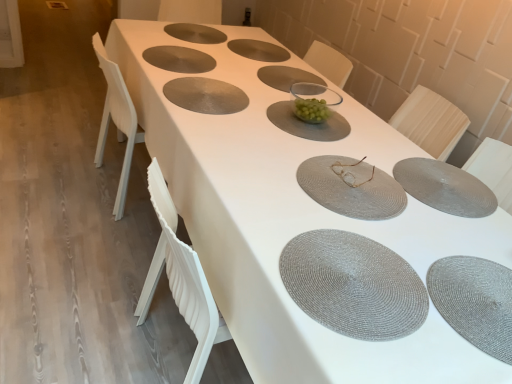
In order to face clear glass bowl at center, arranged as the 6th tableware when ordered from the bottom, should I rotate leftwards or rightwards?

To face it directly, rotate right by 7.644 degrees.

This screenshot has width=512, height=384. Describe the element at coordinates (308, 123) in the screenshot. I see `green glass bowl at center, positioned as the 5th tableware in top-to-bottom order` at that location.

The height and width of the screenshot is (384, 512). Identify the location of matte gray placemat at center, which is counted as the third tableware, starting from the bottom. (351, 187).

I want to click on clear glass bowl at center, which ranks as the 4th tableware in top-to-bottom order, so click(313, 101).

Which is behind, point (199, 90) or point (263, 49)?

Point (263, 49)

Is gray woven placemat at center oriented towards matte gray placemat at upper center, which ranks as the eighth tableware in bottom-to-top order?

No.

How many degrees apart are the facing directions of gray woven placemat at center and matte gray placemat at upper center, which ranks as the eighth tableware in bottom-to-top order?

The facing directions of gray woven placemat at center and matte gray placemat at upper center, which ranks as the eighth tableware in bottom-to-top order, are 178 degrees apart.

Can you confirm if gray woven placemat at center is taller than green glass bowl at center, positioned as the 5th tableware in top-to-bottom order?

Indeed, gray woven placemat at center has a greater height compared to green glass bowl at center, positioned as the 5th tableware in top-to-bottom order.

Is gray woven placemat at center inside the boundaries of green glass bowl at center, arranged as the 5th tableware when ordered from the bottom, or outside?

gray woven placemat at center cannot be found inside green glass bowl at center, arranged as the 5th tableware when ordered from the bottom.

What's the angular difference between gray woven placemat at center and green glass bowl at center, positioned as the 5th tableware in top-to-bottom order,'s facing directions?

The angular difference between gray woven placemat at center and green glass bowl at center, positioned as the 5th tableware in top-to-bottom order, is 3.49 degrees.

Which object is positioned more to the right, gray woven placemat at center or green glass bowl at center, arranged as the 5th tableware when ordered from the bottom?

green glass bowl at center, arranged as the 5th tableware when ordered from the bottom.

Would you say gold metallic glasses at center, the 6th tableware when ordered from top to bottom, is to the left or to the right of gray woven placemat at center, the 2th tableware in the bottom-to-top sequence, in the picture?

gold metallic glasses at center, the 6th tableware when ordered from top to bottom, is positioned on gray woven placemat at center, the 2th tableware in the bottom-to-top sequence,'s left side.

Does gold metallic glasses at center, the 6th tableware when ordered from top to bottom, turn towards gray woven placemat at center, the 2th tableware in the bottom-to-top sequence?

No, gold metallic glasses at center, the 6th tableware when ordered from top to bottom, is not oriented towards gray woven placemat at center, the 2th tableware in the bottom-to-top sequence.

From a real-world perspective, which is physically below, gold metallic glasses at center, which is the fourth tableware from bottom to top, or gray woven placemat at center, the 2th tableware in the bottom-to-top sequence?

gray woven placemat at center, the 2th tableware in the bottom-to-top sequence.

In terms of size, does gold metallic glasses at center, the 6th tableware when ordered from top to bottom, appear bigger or smaller than gray woven placemat at center, the 2th tableware in the bottom-to-top sequence?

Clearly, gold metallic glasses at center, the 6th tableware when ordered from top to bottom, is smaller in size than gray woven placemat at center, the 2th tableware in the bottom-to-top sequence.

Considering their positions, is matte gray placemat at upper center, the second tableware from the top, located in front of or behind gray woven placemat at center, the 2th tableware in the bottom-to-top sequence?

Clearly, matte gray placemat at upper center, the second tableware from the top, is behind gray woven placemat at center, the 2th tableware in the bottom-to-top sequence.

Is there a large distance between matte gray placemat at upper center, the second tableware from the top, and gray woven placemat at center, the 8th tableware positioned from the top?

That's right, there is a large distance between matte gray placemat at upper center, the second tableware from the top, and gray woven placemat at center, the 8th tableware positioned from the top.

From the image's perspective, which tableware is the 6th one above the gray woven placemat at center, the 2th tableware in the bottom-to-top sequence? Please provide its 2D coordinates.

[(258, 50)]

From the image's perspective, is matte gray placemat at upper center, which ranks as the eighth tableware in bottom-to-top order, located above gray woven placemat at center, the 2th tableware in the bottom-to-top sequence?

Indeed, from the image's perspective, matte gray placemat at upper center, which ranks as the eighth tableware in bottom-to-top order, is shown above gray woven placemat at center, the 2th tableware in the bottom-to-top sequence.

Is gray woven placemat at lower right, the 1th tableware from the bottom, wider than green glass bowl at center, positioned as the 5th tableware in top-to-bottom order?

No, gray woven placemat at lower right, the 1th tableware from the bottom, is not wider than green glass bowl at center, positioned as the 5th tableware in top-to-bottom order.

Considering the sizes of objects gray woven placemat at lower right, the 1th tableware from the bottom, and green glass bowl at center, arranged as the 5th tableware when ordered from the bottom, in the image provided, who is taller, gray woven placemat at lower right, the 1th tableware from the bottom, or green glass bowl at center, arranged as the 5th tableware when ordered from the bottom,?

gray woven placemat at lower right, the 1th tableware from the bottom, is taller.

Considering the sizes of objects gray woven placemat at lower right, acting as the 9th tableware starting from the top, and green glass bowl at center, arranged as the 5th tableware when ordered from the bottom, in the image provided, who is smaller, gray woven placemat at lower right, acting as the 9th tableware starting from the top, or green glass bowl at center, arranged as the 5th tableware when ordered from the bottom,?

Smaller between the two is green glass bowl at center, arranged as the 5th tableware when ordered from the bottom.

Between matte gray placemat at upper center, the ninth tableware when ordered from bottom to top, and green glass bowl at center, arranged as the 5th tableware when ordered from the bottom, which one has larger size?

green glass bowl at center, arranged as the 5th tableware when ordered from the bottom, is bigger.

From a real-world perspective, which object rests below the other?

In real-world perspective, matte gray placemat at upper center, the ninth tableware when ordered from bottom to top, is lower.

Is matte gray placemat at upper center, the 1th tableware viewed from the top, taller or shorter than green glass bowl at center, positioned as the 5th tableware in top-to-bottom order?

Clearly, matte gray placemat at upper center, the 1th tableware viewed from the top, is taller compared to green glass bowl at center, positioned as the 5th tableware in top-to-bottom order.

Consider the image. Could green glass bowl at center, arranged as the 5th tableware when ordered from the bottom, be considered to be inside matte gray placemat at upper center, the ninth tableware when ordered from bottom to top?

No, green glass bowl at center, arranged as the 5th tableware when ordered from the bottom, is not a part of matte gray placemat at upper center, the ninth tableware when ordered from bottom to top.

How distant is gray woven placemat at lower right, the 1th tableware from the bottom, from matte gray placemat at upper center, the third tableware from the top?

4.70 feet.

The height and width of the screenshot is (384, 512). I want to click on the 2nd tableware directly above the gray woven placemat at lower right, acting as the 9th tableware starting from the top (from a real-world perspective), so click(x=179, y=59).

Does gray woven placemat at lower right, the 1th tableware from the bottom, have a lesser width compared to matte gray placemat at upper center, the 7th tableware ordered from the bottom?

Indeed, gray woven placemat at lower right, the 1th tableware from the bottom, has a lesser width compared to matte gray placemat at upper center, the 7th tableware ordered from the bottom.

Which is more to the left, gray woven placemat at lower right, the 1th tableware from the bottom, or matte gray placemat at upper center, the third tableware from the top?

matte gray placemat at upper center, the third tableware from the top, is more to the left.

Starting from the gray woven placemat at center, which tableware is the 3rd one behind? Please provide its 2D coordinates.

[(258, 50)]

From the gray woven placemat at center, count 1st tablewares forward and point to it. Please provide its 2D coordinates.

[(308, 123)]

Which object lies further to the anchor point matte gray placemat at upper center, which ranks as the eighth tableware in bottom-to-top order, green glass bowl at center, arranged as the 5th tableware when ordered from the bottom, or gold metallic glasses at center, the 6th tableware when ordered from top to bottom?

Based on the image, gold metallic glasses at center, the 6th tableware when ordered from top to bottom, appears to be further to matte gray placemat at upper center, which ranks as the eighth tableware in bottom-to-top order.

Looking at the image, which one is located further to matte gray placemat at upper center, which ranks as the eighth tableware in bottom-to-top order, matte gray placemat at center, which is counted as the third tableware, starting from the bottom, or gray woven placemat at lower right, the 1th tableware from the bottom?

gray woven placemat at lower right, the 1th tableware from the bottom, lies further to matte gray placemat at upper center, which ranks as the eighth tableware in bottom-to-top order, than the other object.

Which object lies further to the anchor point gray woven placemat at lower right, acting as the 9th tableware starting from the top, gray woven placemat at center or matte gray placemat at upper center, the third tableware from the top?

matte gray placemat at upper center, the third tableware from the top, lies further to gray woven placemat at lower right, acting as the 9th tableware starting from the top, than the other object.

Considering their positions, is gold metallic glasses at center, which is the fourth tableware from bottom to top, positioned further to gray woven placemat at center than gray woven placemat at center?

Among the two, gold metallic glasses at center, which is the fourth tableware from bottom to top, is located further to gray woven placemat at center.

When comparing their distances from matte gray placemat at upper center, the second tableware from the top, does matte gray placemat at upper center, the 7th tableware ordered from the bottom, or gray woven placemat at lower right, the 1th tableware from the bottom, seem closer?

Based on the image, matte gray placemat at upper center, the 7th tableware ordered from the bottom, appears to be nearer to matte gray placemat at upper center, the second tableware from the top.

From the image, which object appears to be nearer to matte gray placemat at upper center, the second tableware from the top, green glass bowl at center, positioned as the 5th tableware in top-to-bottom order, or clear glass bowl at center, arranged as the 6th tableware when ordered from the bottom?

clear glass bowl at center, arranged as the 6th tableware when ordered from the bottom, is closer to matte gray placemat at upper center, the second tableware from the top.

Based on their spatial positions, is matte gray placemat at upper center, the ninth tableware when ordered from bottom to top, or green glass bowl at center, positioned as the 5th tableware in top-to-bottom order, further from gray woven placemat at center, the 8th tableware positioned from the top?

Answer: The object further to gray woven placemat at center, the 8th tableware positioned from the top, is matte gray placemat at upper center, the ninth tableware when ordered from bottom to top.

Estimate the real-world distances between objects in this image. Which object is further from matte gray placemat at upper center, the 1th tableware viewed from the top, gray woven placemat at lower right, the 1th tableware from the bottom, or green glass bowl at center, positioned as the 5th tableware in top-to-bottom order?

gray woven placemat at lower right, the 1th tableware from the bottom, is further to matte gray placemat at upper center, the 1th tableware viewed from the top.

The width and height of the screenshot is (512, 384). I want to click on plate located between matte gray placemat at upper center, the 7th tableware ordered from the bottom, and clear glass bowl at center, arranged as the 6th tableware when ordered from the bottom, in the left-right direction, so click(x=286, y=77).

What are the coordinates of `plate positioned between gray woven placemat at center, the 8th tableware positioned from the top, and matte gray placemat at upper center, which ranks as the eighth tableware in bottom-to-top order, from near to far` in the screenshot? It's located at (286, 77).

Find the location of `plate between green glass bowl at center, arranged as the 5th tableware when ordered from the bottom, and matte gray placemat at upper center, the ninth tableware when ordered from bottom to top, along the z-axis`. plate between green glass bowl at center, arranged as the 5th tableware when ordered from the bottom, and matte gray placemat at upper center, the ninth tableware when ordered from bottom to top, along the z-axis is located at coordinates (286, 77).

You are a GUI agent. You are given a task and a screenshot of the screen. Output one action in this format:
    pyautogui.click(x=<x>, y=<y>)
    Task: Click on the plate between matte gray placemat at upper center, the 7th tableware ordered from the bottom, and green glass bowl at center, arranged as the 5th tableware when ordered from the bottom
    The image size is (512, 384).
    Given the screenshot: What is the action you would take?
    pyautogui.click(x=286, y=77)